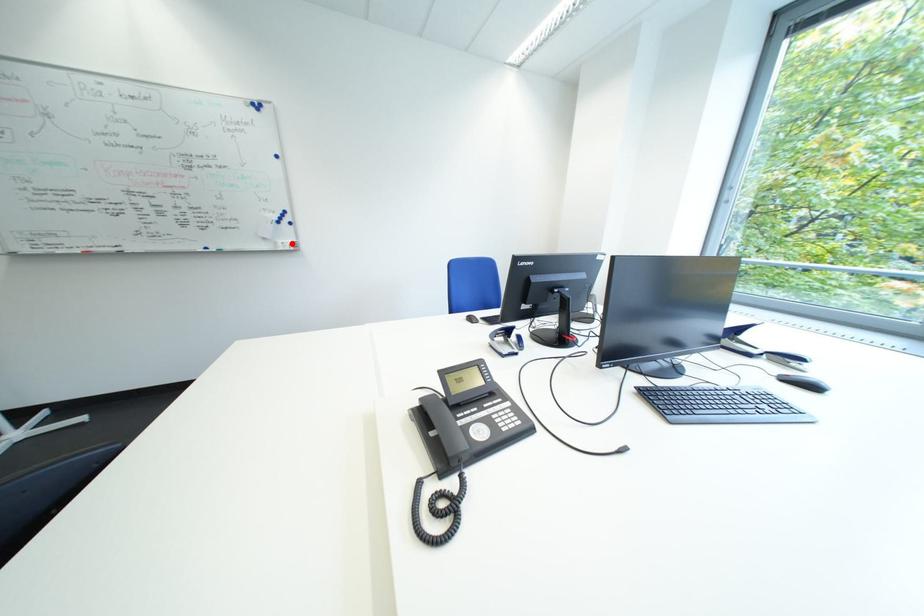
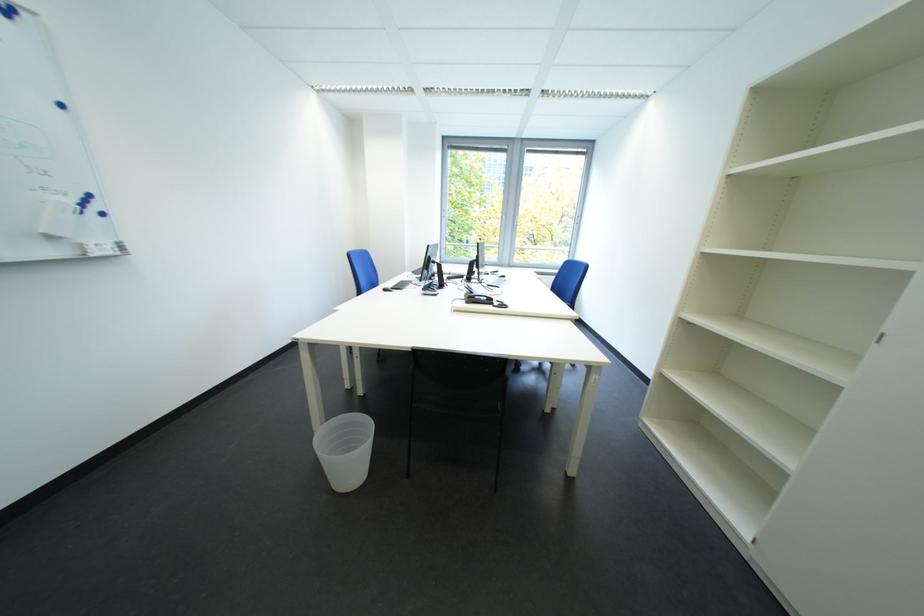
In the second image, find the point that corresponds to the highlighted location in the first image.

(101, 245)